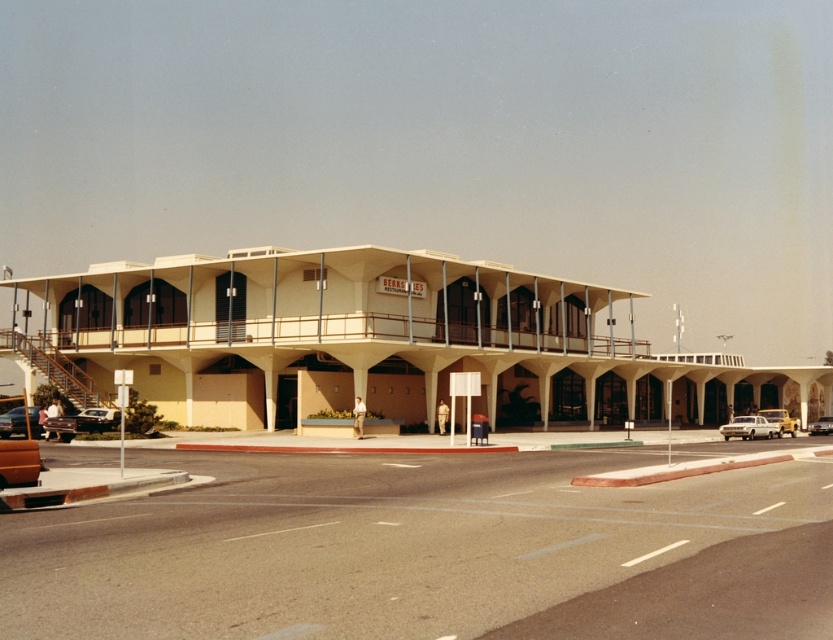
Question: Is shiny silver sedan at lower left positioned behind silver metallic sedan at center?

Choices:
 (A) no
 (B) yes

Answer: (A)

Question: Does silver metallic sedan at center appear on the right side of shiny black sedan at lower left?

Choices:
 (A) no
 (B) yes

Answer: (B)

Question: Estimate the real-world distances between objects in this image. Which object is farther from the shiny silver sedan at lower left?

Choices:
 (A) beige concrete motel at center
 (B) silver metallic sedan at center
 (C) shiny black sedan at lower left
 (D) shiny silver sedan at center

Answer: (D)

Question: Is shiny silver sedan at lower left above shiny black sedan at lower left?

Choices:
 (A) no
 (B) yes

Answer: (B)

Question: Among these objects, which one is farthest from the camera?

Choices:
 (A) shiny black sedan at lower left
 (B) shiny silver sedan at center
 (C) beige concrete motel at center

Answer: (B)

Question: Which point is farther to the camera?

Choices:
 (A) shiny black sedan at lower left
 (B) shiny silver sedan at lower left

Answer: (A)